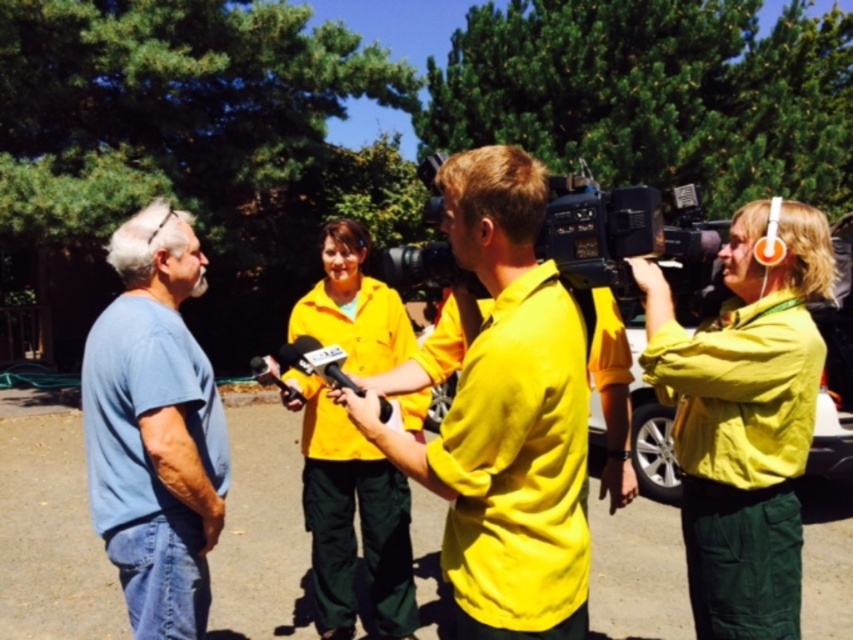
You are a photographer trying to capture a clear shot of the blue cotton shirt at left and the yellow matte shirt at center. Based on their positions, which one is higher in the frame?

The yellow matte shirt at center is located above the blue cotton shirt at left, so the yellow matte shirt at center is higher in the frame.

You are a photographer standing in the scene and want to take a photo of the blue cotton shirt at left and the black plastic video camera at center. Which object should you focus on first if you want to capture both in the same frame without moving your camera?

The blue cotton shirt at left is taller than the black plastic video camera at center, so you should focus on the blue cotton shirt at left first to ensure it fits within the frame.